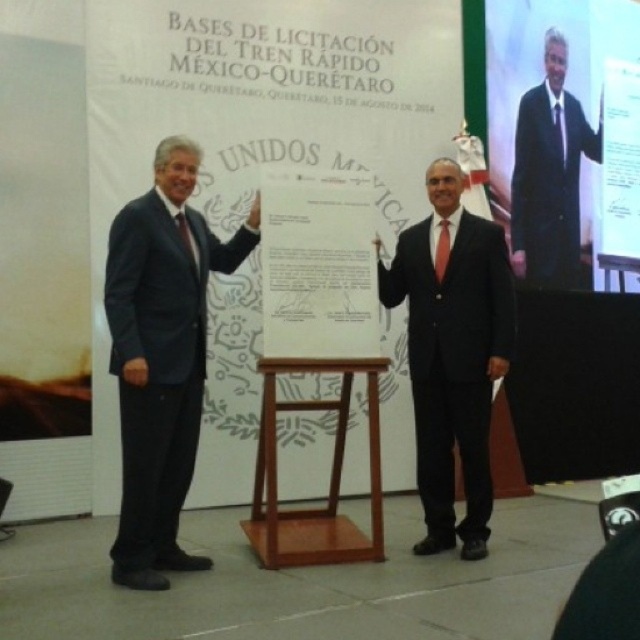
You are a photographer who needs to capture a closeup shot of the banner text. You notice a point at coordinates (548, 177) on the image. What object is located at that point?

The point at coordinates (548, 177) corresponds to the matte black suit at upper right.

You are a photographer at the event and want to take a photo of the two men. Since the banner is important, you need to ensure that the matte black suit at upper right and the matte black hand at center are both visible in the frame. Based on their positions, which object should be placed closer to the right edge of the photo?

The matte black suit at upper right should be placed closer to the right edge of the photo because it is positioned on the right side of the matte black hand at center.

You are an event photographer who needs to capture a candid shot of the two men standing in front of the banner. The camera is positioned at the point with coordinates (x=330, y=476). What object might be obstructing your view of the men?

The light brown wood stool at center located at point (x=330, y=476) could be obstructing your view of the men since the camera is positioned at that point.